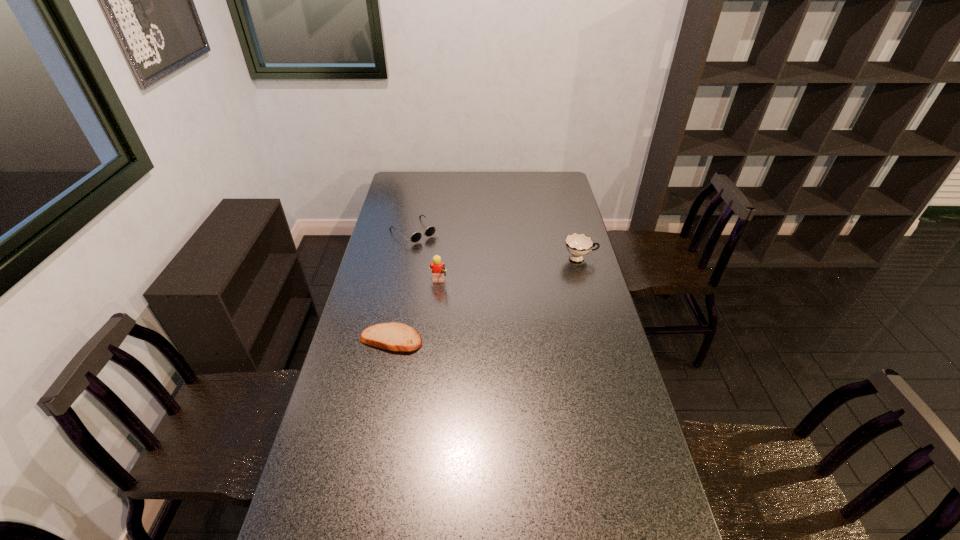
Identify the location of pita bread. The height and width of the screenshot is (540, 960). (393, 336).

Identify the location of the nearest object. This screenshot has height=540, width=960. (393, 336).

This screenshot has height=540, width=960. In order to click on cup in this screenshot , I will do `click(578, 245)`.

I want to click on the third nearest object, so 578,245.

Locate an element on the screen. Lego is located at coordinates (438, 268).

Find the location of a particular element. The image size is (960, 540). the tallest object is located at coordinates (438, 268).

What are the coordinates of `the farthest object` in the screenshot? It's located at (429, 231).

The width and height of the screenshot is (960, 540). Find the location of `the third tallest object`. the third tallest object is located at coordinates click(x=429, y=231).

This screenshot has height=540, width=960. Find the location of `blank area located on the right of the pita bread`. blank area located on the right of the pita bread is located at coordinates (475, 340).

Where is `free spot located 0.060m in front of the tallest object with the accessory visible`? This screenshot has width=960, height=540. free spot located 0.060m in front of the tallest object with the accessory visible is located at coordinates (463, 284).